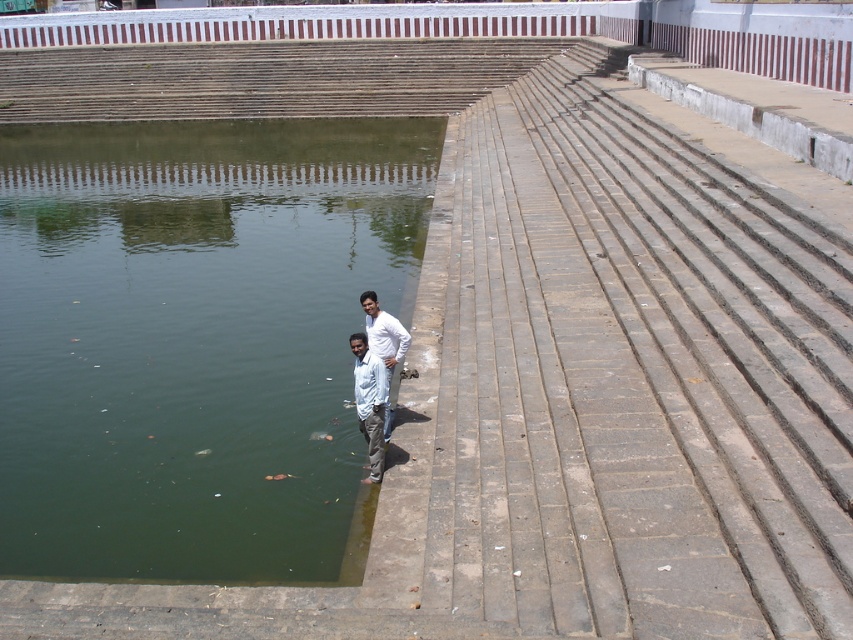
You are standing on the stone steps leading to the green concrete lake at lower left and the white cotton shirt at lower center. Which object is closer to your right side?

The white cotton shirt at lower center is closer to your right side since it is positioned to the right of the green concrete lake at lower left.

You are standing at the top of the stone steps leading down to the water. You see two points marked in the scene. Which point is closer to you, point (x=57, y=131) or point (x=392, y=342)?

Point (x=57, y=131) is closer to you because it is further to the viewer than point (x=392, y=342).

You are a photographer trying to capture a wide shot of the green concrete lake at lower left and the white cotton shirt at lower center. Since you want both subjects to be clearly visible, which object should you focus on first to ensure proper depth of field?

Result: The green concrete lake at lower left is larger in size than the white cotton shirt at lower center, so you should focus on the green concrete lake at lower left first to ensure both are in focus.